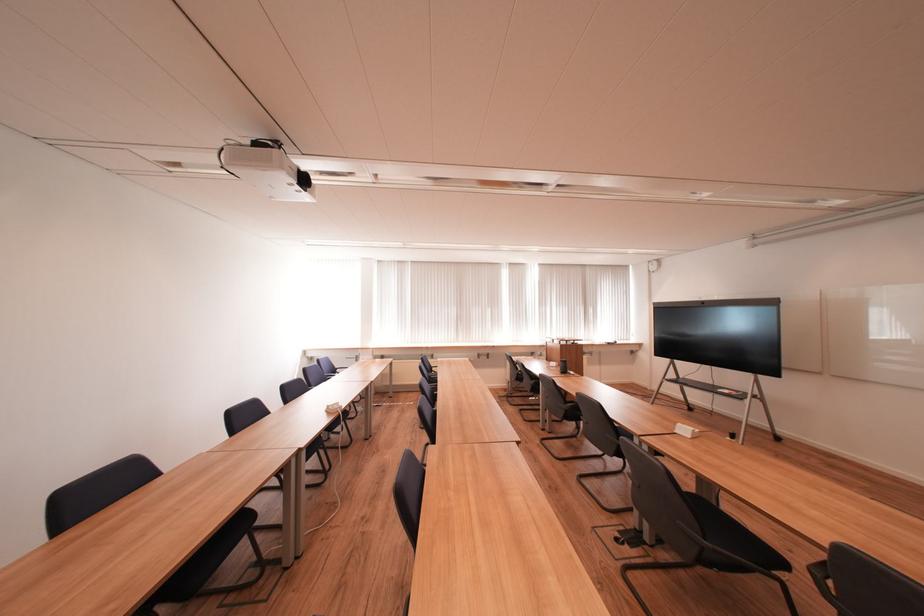
Where would you sit the black chair sitting surface? Please return your answer as a coordinate pair (x, y).

(734, 537)